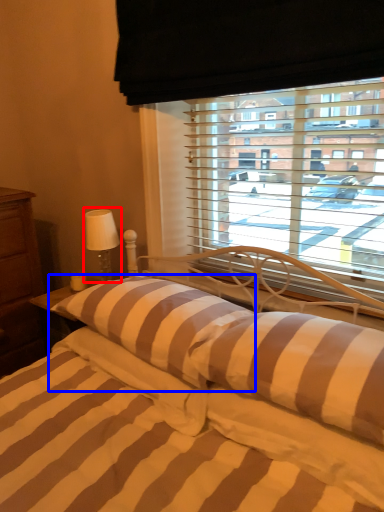
Question: Which object is further to the camera taking this photo, table lamp (highlighted by a red box) or pillow (highlighted by a blue box)?

Choices:
 (A) table lamp
 (B) pillow

Answer: (A)